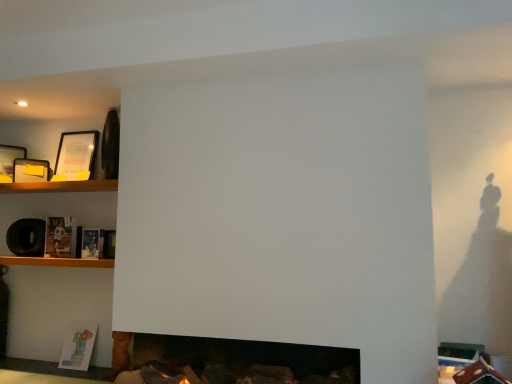
You are a GUI agent. You are given a task and a screenshot of the screen. Output one action in this format:
    pyautogui.click(x=<x>, y=<y>)
    Task: Click on the blank area beneath wooden shelf at lower left, which ranks as the first shelf in bottom-to-top order (from a real-world perspective)
    
    Given the screenshot: What is the action you would take?
    pyautogui.click(x=69, y=370)